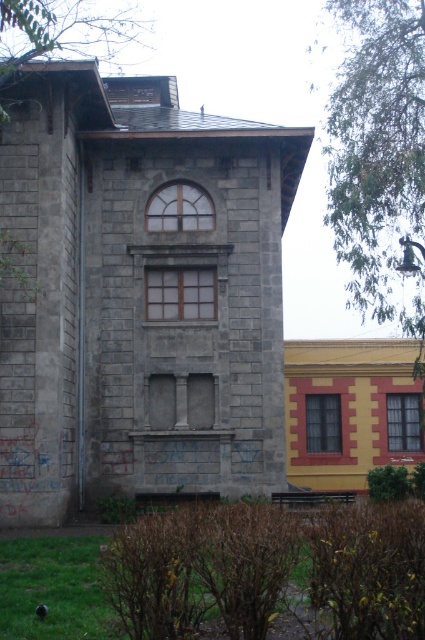
Question: Can you confirm if gray stone tower at center is wider than brown wooden window at center?

Choices:
 (A) yes
 (B) no

Answer: (A)

Question: Can you confirm if gray stone tower at center is wider than clear glass window at center?

Choices:
 (A) yes
 (B) no

Answer: (A)

Question: Does matte glass window at upper center have a smaller size compared to matte glass window at center?

Choices:
 (A) no
 (B) yes

Answer: (B)

Question: Which object is closer to the camera taking this photo?

Choices:
 (A) matte glass window at upper center
 (B) matte glass window at center
 (C) brown wooden window at center
 (D) gray stone tower at center

Answer: (D)

Question: Which object is closer to the camera taking this photo?

Choices:
 (A) brown wooden window at center
 (B) matte glass window at upper center
 (C) clear glass window at center
 (D) gray stone tower at center

Answer: (D)

Question: Which of these objects is positioned farthest from the gray stone tower at center?

Choices:
 (A) matte glass window at upper center
 (B) brown wooden window at center

Answer: (B)